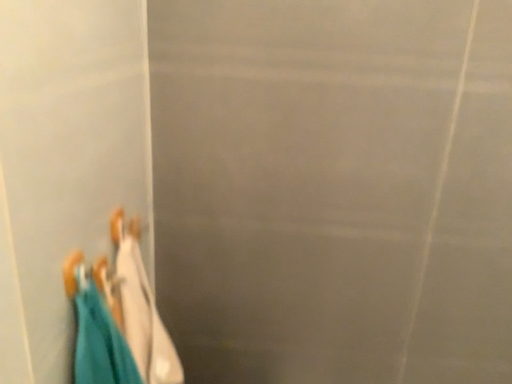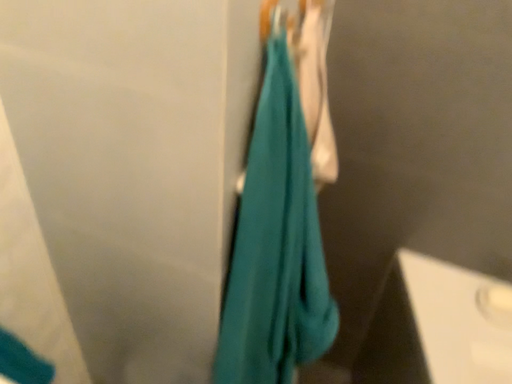
Question: How did the camera likely rotate when shooting the video?

Choices:
 (A) rotated upward
 (B) rotated downward

Answer: (B)